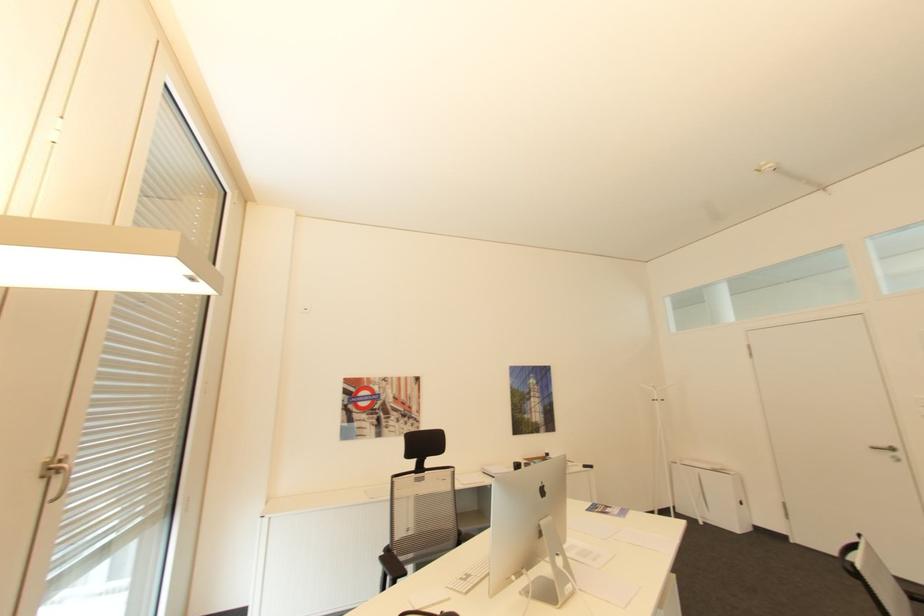
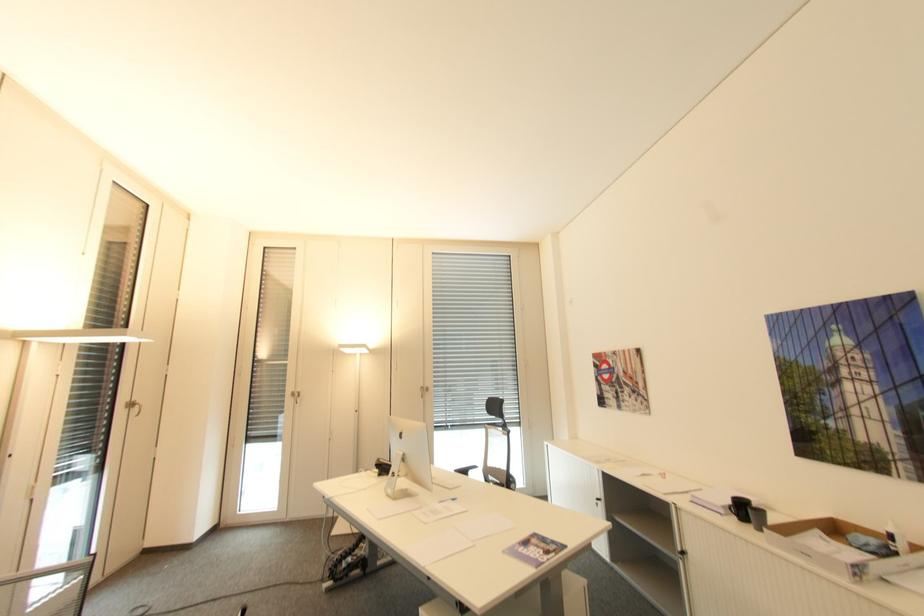
The point at (553, 454) is marked in the first image. Where is the corresponding point in the second image?

(895, 537)